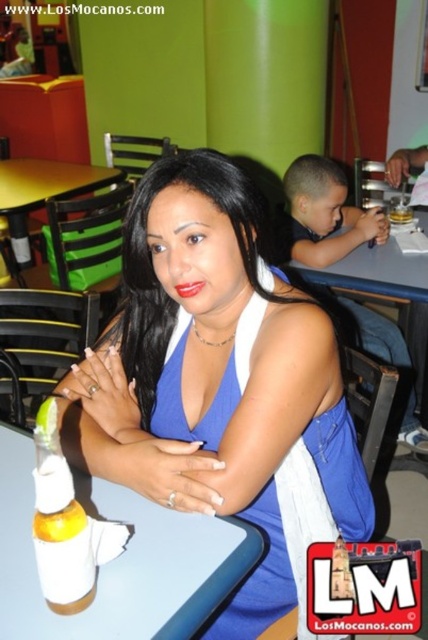
Question: Estimate the real-world distances between objects in this image. Which object is closer to the translucent plastic bottle at lower left?

Choices:
 (A) white plastic table at center
 (B) smooth plastic table at center

Answer: (A)

Question: Does smooth plastic table at center appear under matte red lipstick at center?

Choices:
 (A) no
 (B) yes

Answer: (A)

Question: Among these points, which one is farthest from the camera?

Choices:
 (A) (424, 285)
 (B) (2, 436)
 (C) (74, 529)
 (D) (204, 282)

Answer: (A)

Question: Does black silky hair at center have a larger size compared to matte red lipstick at center?

Choices:
 (A) no
 (B) yes

Answer: (B)

Question: Which of the following is the closest to the observer?

Choices:
 (A) black silky hair at center
 (B) white plastic table at center

Answer: (B)

Question: Is blue satin dress at center closer to camera compared to white plastic table at center?

Choices:
 (A) no
 (B) yes

Answer: (A)